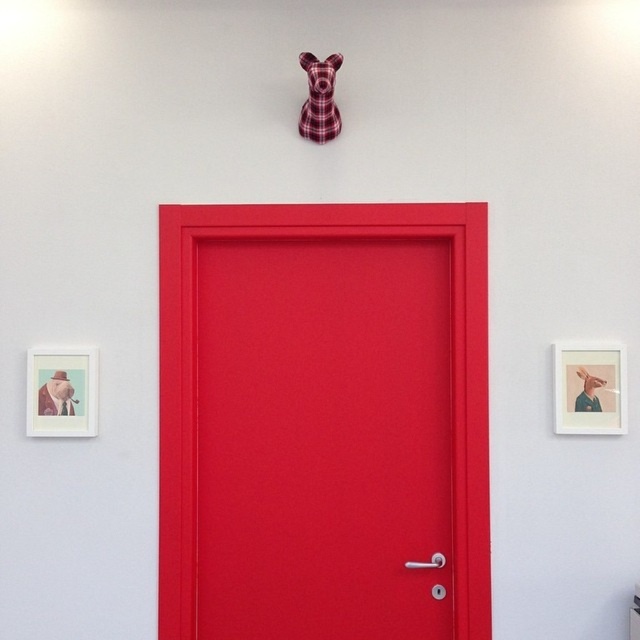
Can you confirm if matte red door at center is thinner than matte white picture frame at lower left?

No.

Looking at this image, does matte red door at center have a greater height compared to matte white picture frame at lower left?

Correct, matte red door at center is much taller as matte white picture frame at lower left.

This screenshot has height=640, width=640. I want to click on matte red door at center, so click(x=323, y=420).

Which of these two, matte white picture frame at lower left or plaid fabric dog at upper center, stands shorter?

Standing shorter between the two is plaid fabric dog at upper center.

Who is positioned more to the left, matte white picture frame at lower left or plaid fabric dog at upper center?

Positioned to the left is matte white picture frame at lower left.

Does point (54, 397) lie in front of point (330, 68)?

That is False.

Locate an element on the screen. matte white picture frame at lower left is located at coordinates (61, 392).

Can you confirm if matte red door at center is taller than plaid fabric dog at upper center?

Yes, matte red door at center is taller than plaid fabric dog at upper center.

Between point (324, 618) and point (300, 122), which one is positioned behind?

Positioned behind is point (324, 618).

Measure the distance between point (225, 620) and camera.

2.84 meters

This screenshot has width=640, height=640. What are the coordinates of `matte red door at center` in the screenshot? It's located at (323, 420).